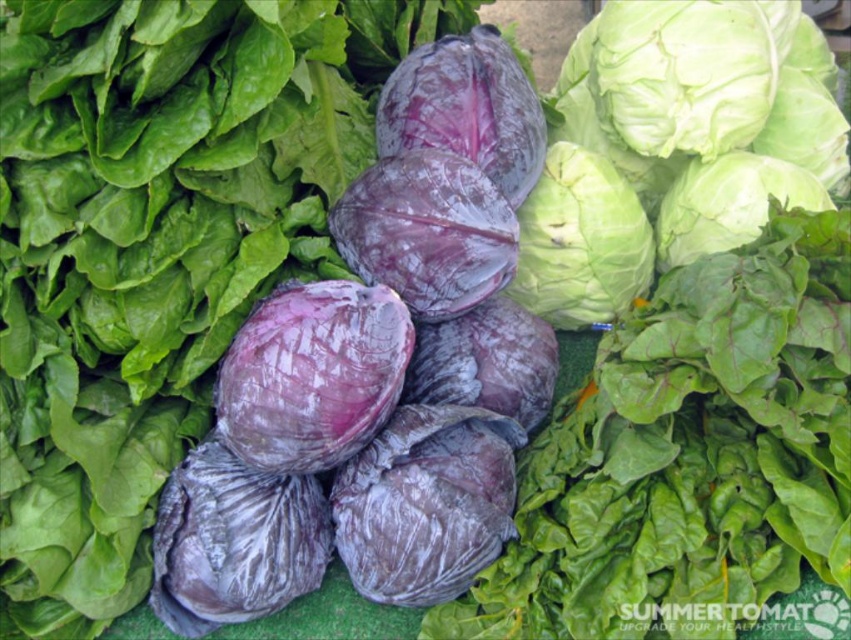
Does purple matte cabbage at center appear under green crisp at center?

Yes, purple matte cabbage at center is below green crisp at center.

Measure the distance between point (261, 426) and camera.

Point (261, 426) and camera are 4.05 feet apart from each other.

The width and height of the screenshot is (851, 640). Identify the location of purple matte cabbage at center. (312, 374).